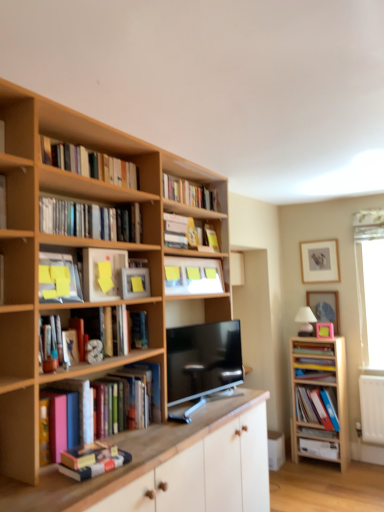
Question: Does hardcover book at upper center, which is the second book in top-to-bottom order, appear on the left side of wooden book at right, the eighth book when ordered from top to bottom?

Choices:
 (A) yes
 (B) no

Answer: (A)

Question: Is hardcover book at upper center, which is the second book in top-to-bottom order, not close to wooden book at right, the fourth book ordered from the bottom?

Choices:
 (A) no
 (B) yes

Answer: (B)

Question: Is hardcover book at upper center, marked as the 10th book in a bottom-to-top arrangement, bigger than wooden book at right, the eighth book when ordered from top to bottom?

Choices:
 (A) yes
 (B) no

Answer: (A)

Question: Is hardcover book at upper center, marked as the 10th book in a bottom-to-top arrangement, closer to the viewer compared to wooden book at right, the eighth book when ordered from top to bottom?

Choices:
 (A) yes
 (B) no

Answer: (A)

Question: From a real-world perspective, does hardcover book at upper center, marked as the 10th book in a bottom-to-top arrangement, sit lower than wooden book at right, the fourth book ordered from the bottom?

Choices:
 (A) no
 (B) yes

Answer: (A)

Question: Can you confirm if hardcover book at upper center, which is the second book in top-to-bottom order, is thinner than wooden book at right, the eighth book when ordered from top to bottom?

Choices:
 (A) yes
 (B) no

Answer: (A)

Question: Are matte blue book at right, the tenth book in the top-to-bottom sequence, and wooden cabinet at center, the first cabinetry in the front-to-back sequence, making contact?

Choices:
 (A) no
 (B) yes

Answer: (A)

Question: Does matte blue book at right, which is the 2th book in bottom-to-top order, have a lesser height compared to wooden cabinet at center, the 2th cabinetry in the right-to-left sequence?

Choices:
 (A) yes
 (B) no

Answer: (A)

Question: From the image's perspective, would you say matte blue book at right, the tenth book in the top-to-bottom sequence, is shown under wooden cabinet at center, the 1th cabinetry from the left?

Choices:
 (A) no
 (B) yes

Answer: (A)

Question: Is matte blue book at right, which is the 2th book in bottom-to-top order, at the right side of wooden cabinet at center, the 1th cabinetry from the left?

Choices:
 (A) yes
 (B) no

Answer: (A)

Question: Considering the relative sizes of matte blue book at right, the tenth book in the top-to-bottom sequence, and wooden cabinet at center, the 1th cabinetry from the left, in the image provided, is matte blue book at right, the tenth book in the top-to-bottom sequence, smaller than wooden cabinet at center, the 1th cabinetry from the left,?

Choices:
 (A) no
 (B) yes

Answer: (B)

Question: From a real-world perspective, is matte blue book at right, which is the 2th book in bottom-to-top order, on wooden cabinet at center, the 1th cabinetry from the left?

Choices:
 (A) no
 (B) yes

Answer: (B)

Question: Does wooden cabinet at right, which appears as the 2th cabinetry when viewed from the left, have a greater width compared to black glossy tv at center?

Choices:
 (A) yes
 (B) no

Answer: (A)